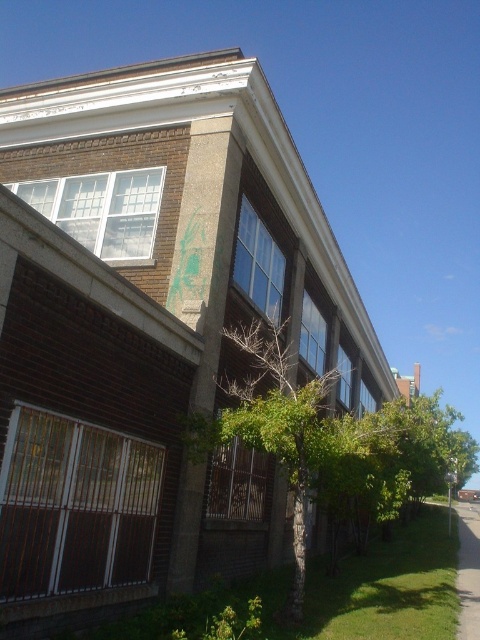
You are a gardener who needs to water all the plants in the scene. Starting from the green grass at lower right, which direction should you move to reach the green leafy tree at center?

Since the green leafy tree at center is larger in size than the green grass at lower right, you should move towards the center of the scene from the green grass at lower right to reach the tree.

You are standing in front of the building and want to determine the relative positions of two points marked on the lawn. Which point is closer to you, point 1 at coordinates point (x=297, y=406) or point 2 at coordinates point (x=465, y=547)?

Point 1 at coordinates point (x=297, y=406) is closer to the viewer than point 2 at coordinates point (x=465, y=547).